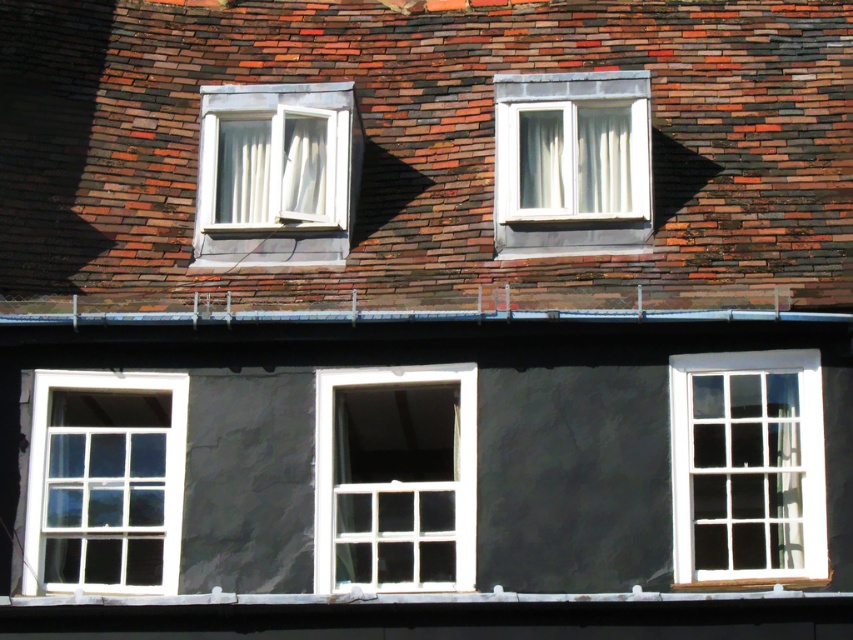
You are a window cleaner standing on the roof of the building. You need to clean the white plastic window at upper center but there are brown shingles at upper center in the way. Can you reach the window without moving the shingles?

The brown shingles at upper center is positioned over white plastic window at upper center, so you cannot reach the window without moving the shingles because they are blocking it.

You are an architect evaluating the building facade. You need to install a new decorative element. If the brown shingles at upper center and the white plastic window at upper center are both candidates for placement, which one has a bigger area to work with?

The brown shingles at upper center has a larger size compared to the white plastic window at upper center, so the brown shingles at upper center provides a bigger area to work with.

You are standing in front of the building and notice a point marked at coordinates [395,477]. What object is located at that point?

The white wooden window at center is located at point [395,477].